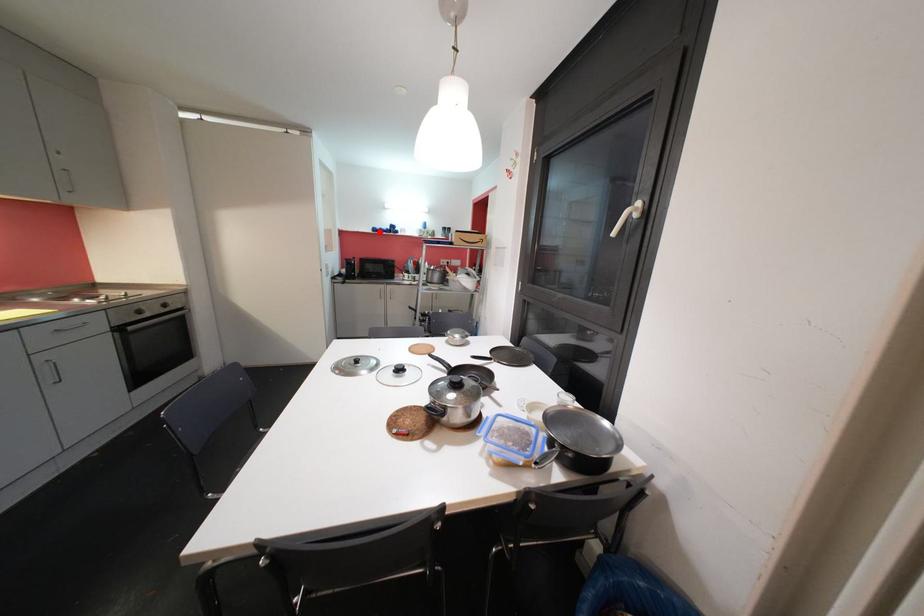
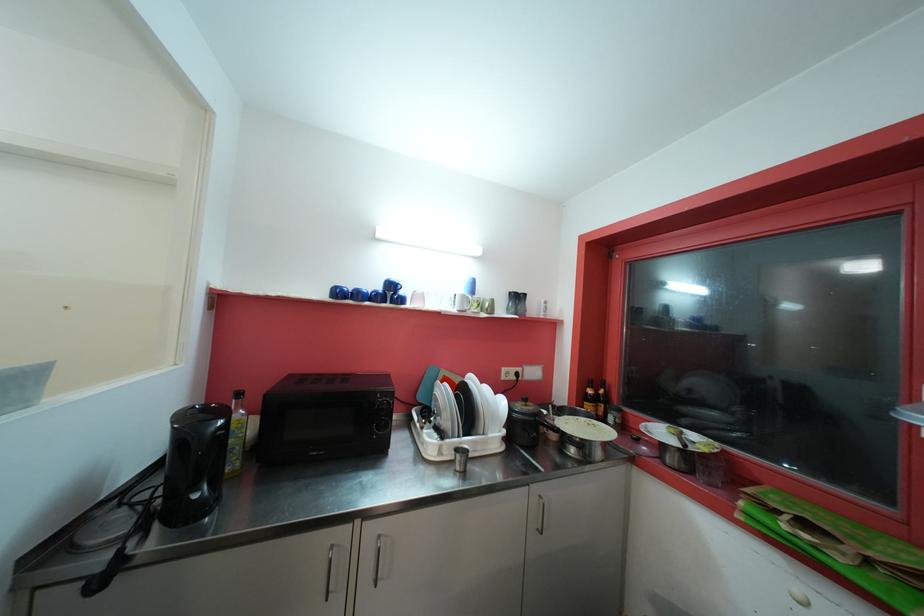
Question: A red point is marked in image1. In image2, is the corresponding 3D point closer to the camera or farther? Reply with the corresponding letter.

Choices:
 (A) The corresponding 3D point is closer.
 (B) The corresponding 3D point is farther.

Answer: (B)